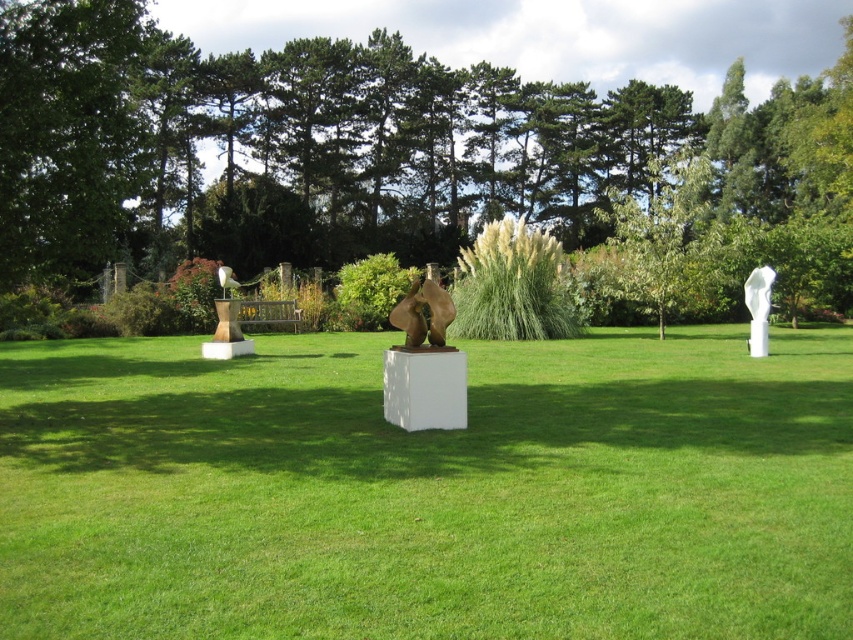
Looking at this image, is green grass at center below green leafy tree at center?

Yes, green grass at center is below green leafy tree at center.

Does green grass at center have a smaller size compared to green leafy tree at center?

Yes, green grass at center is smaller than green leafy tree at center.

You are a GUI agent. You are given a task and a screenshot of the screen. Output one action in this format:
    pyautogui.click(x=<x>, y=<y>)
    Task: Click on the green grass at center
    This screenshot has height=640, width=853.
    Given the screenshot: What is the action you would take?
    pyautogui.click(x=428, y=490)

Which of these two, green grass at center or white glossy statue at upper right, stands taller?

With more height is green grass at center.

Find the location of a particular element. The height and width of the screenshot is (640, 853). green grass at center is located at coordinates (428, 490).

Which is behind, point (555, 570) or point (749, 333)?

Point (749, 333)

Find the location of `green grass at center`. green grass at center is located at coordinates (428, 490).

Is green leafy tree at center thinner than bronze sculpture at center?

No.

Can you confirm if green leafy tree at center is wider than bronze sculpture at center?

Indeed, green leafy tree at center has a greater width compared to bronze sculpture at center.

The height and width of the screenshot is (640, 853). What are the coordinates of `green leafy tree at center` in the screenshot? It's located at (402, 164).